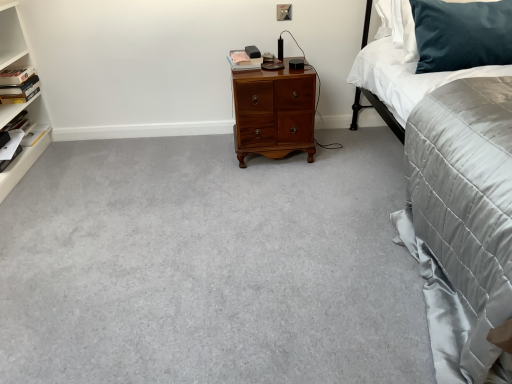
You are a GUI agent. You are given a task and a screenshot of the screen. Output one action in this format:
    pyautogui.click(x=<x>, y=<y>)
    Task: Click on the free space in front of shiny brown wooden nightstand at center
    This screenshot has height=384, width=512.
    Given the screenshot: What is the action you would take?
    pyautogui.click(x=274, y=180)